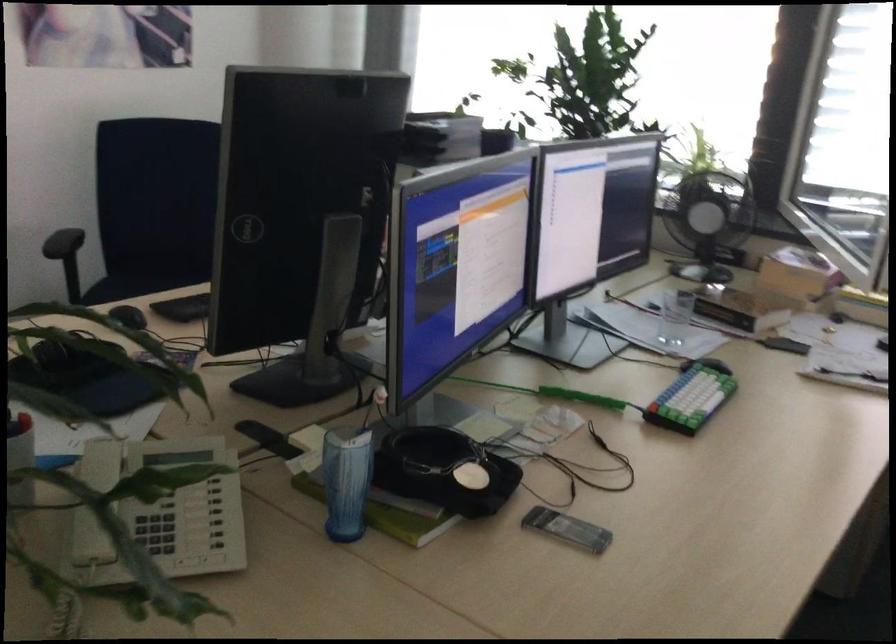
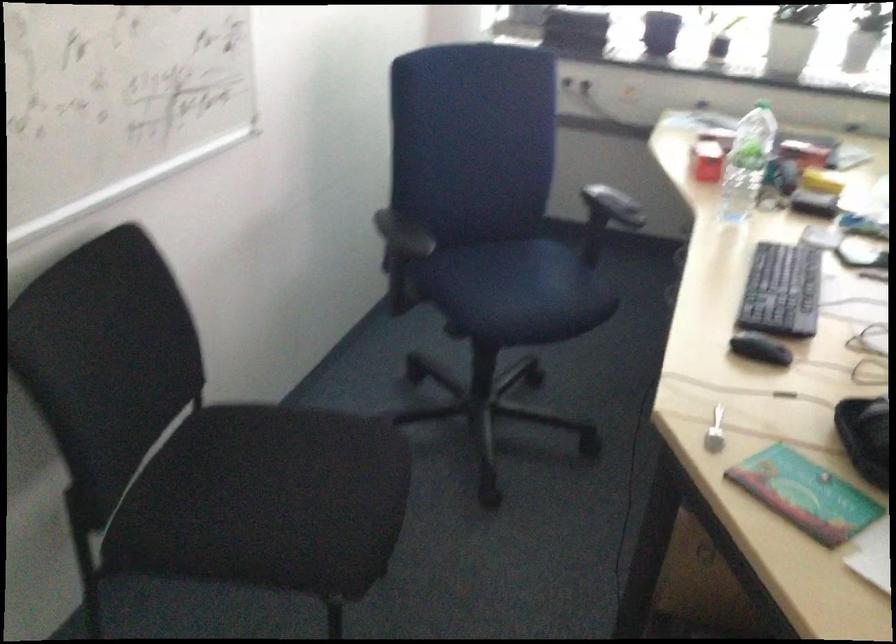
In a continuous first-person perspective shot, in which direction is the camera moving?

The cameraman moved toward left, forward.